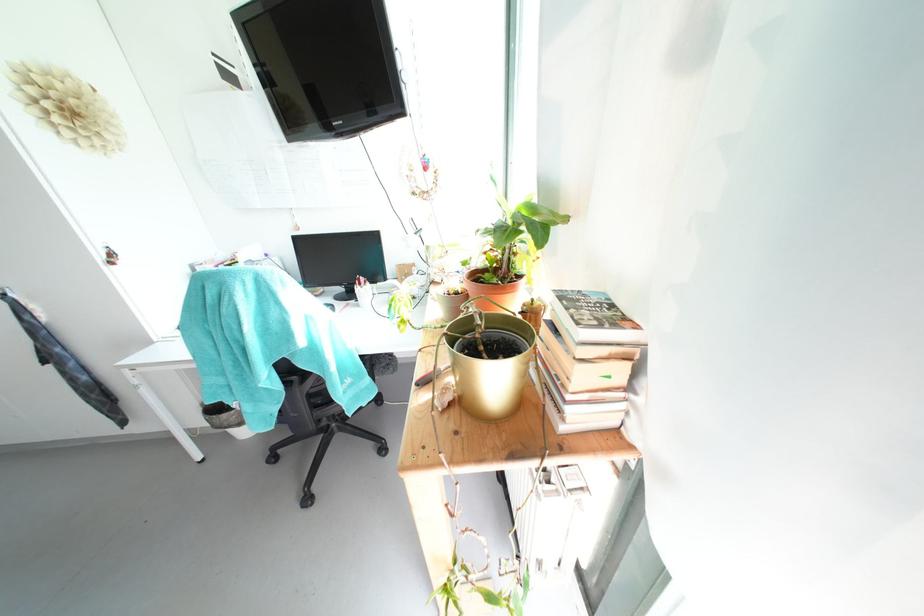
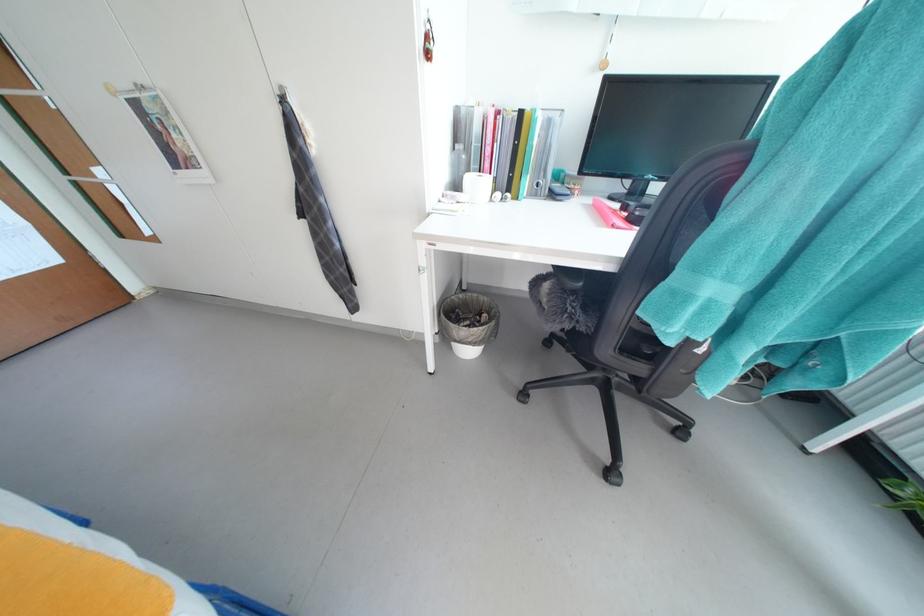
The point at (108, 259) is marked in the first image. Where is the corresponding point in the second image?

(428, 41)